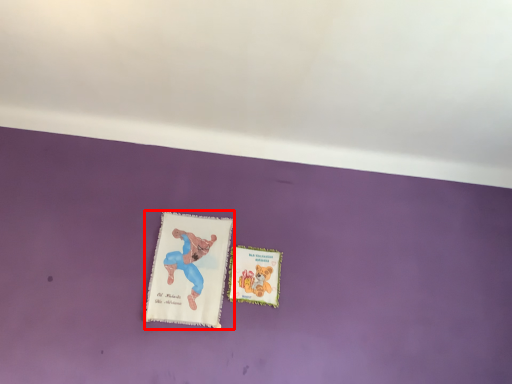
Question: In this image, where is paperback book (annotated by the red box) located relative to paperback book?

Choices:
 (A) right
 (B) left

Answer: (B)